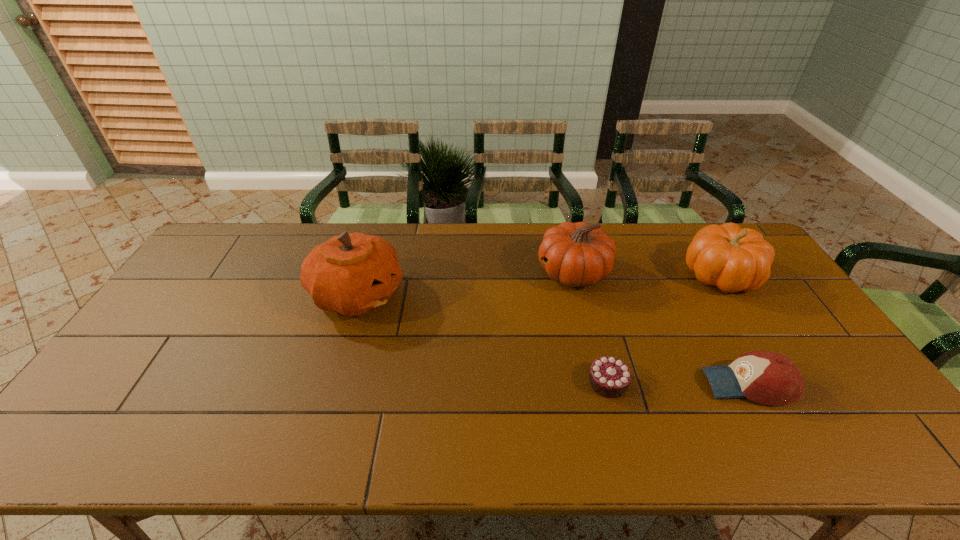
Where is `the tallest pumpkin`? the tallest pumpkin is located at coordinates (351, 274).

The image size is (960, 540). I want to click on the leftmost pumpkin, so [x=351, y=274].

Image resolution: width=960 pixels, height=540 pixels. Identify the location of the second pumpkin from right to left. (578, 255).

The width and height of the screenshot is (960, 540). Identify the location of the rightmost pumpkin. (732, 258).

Where is `the second shortest object`? The height and width of the screenshot is (540, 960). the second shortest object is located at coordinates (769, 378).

At what (x,y) coordinates should I click in order to perform the action: click on chocolate cake. Please return your answer as a coordinate pair (x, y). Looking at the image, I should click on (610, 377).

Find the location of a particular element. vacant region located 0.260m on the front-facing side of the leftmost pumpkin is located at coordinates (489, 295).

The image size is (960, 540). What are the coordinates of `free space located 0.080m on the face of the second pumpkin from left to right` in the screenshot? It's located at (512, 273).

In order to click on vacant region located on the face of the second pumpkin from left to right in this screenshot , I will do `click(451, 273)`.

Locate an element on the screen. The image size is (960, 540). free spot located 0.200m on the face of the second pumpkin from left to right is located at coordinates (475, 273).